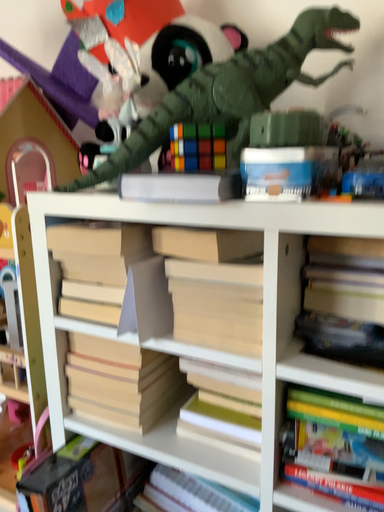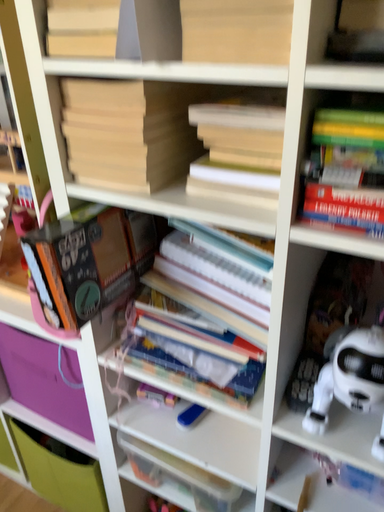
Question: Which way did the camera rotate in the video?

Choices:
 (A) rotated downward
 (B) rotated upward

Answer: (A)